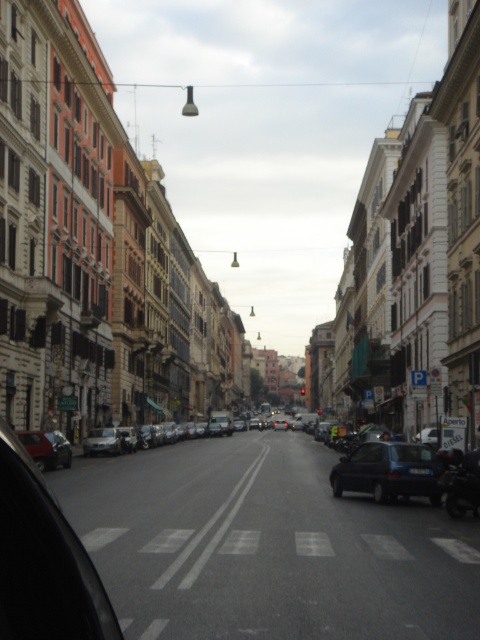
You are driving a car and want to park it in a spot that is exactly at point (47, 449). Is there already a car parked there?

Yes, there is already a matte black car at lower left parked at point (47, 449).

You are a delivery driver who needs to park your blue metallic car at center in a spot that is 1.2 meters wide. Can you fit your car into the parking spot?

The blue metallic car at center is positioned at coordinates point (387, 472), which does not provide information about its width. Therefore, it is impossible to determine if it can fit into a 1.2 meter wide parking spot based on the given data.